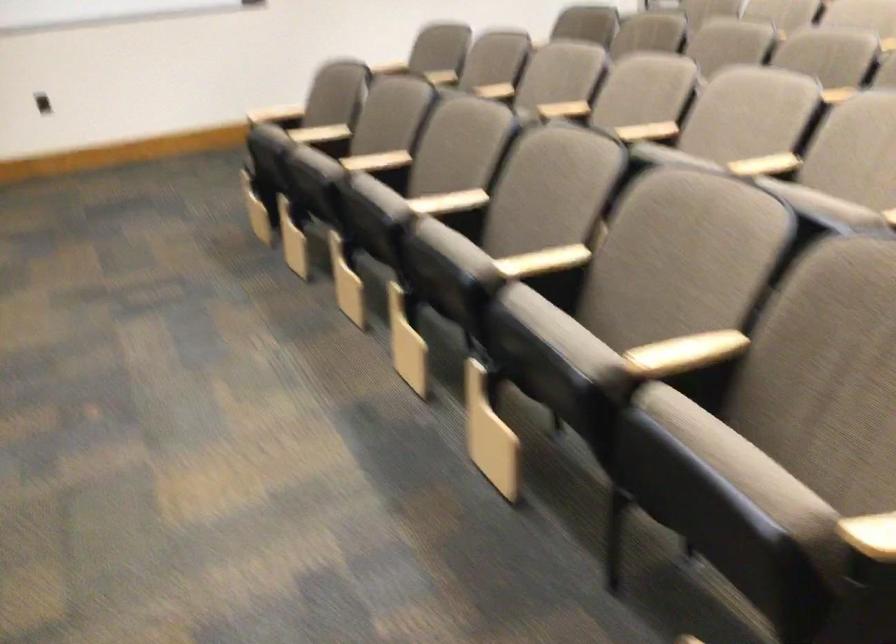
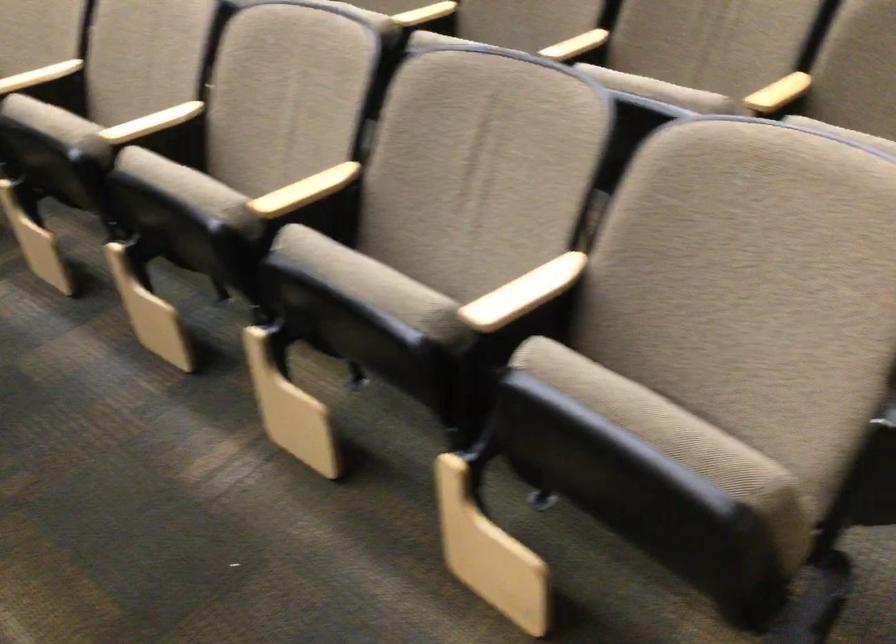
Question: The camera is either moving clockwise (left) or counter-clockwise (right) around the object. The first image is from the beginning of the video and the second image is from the end. Is the camera moving left or right when shooting the video?

Choices:
 (A) Left
 (B) Right

Answer: (A)